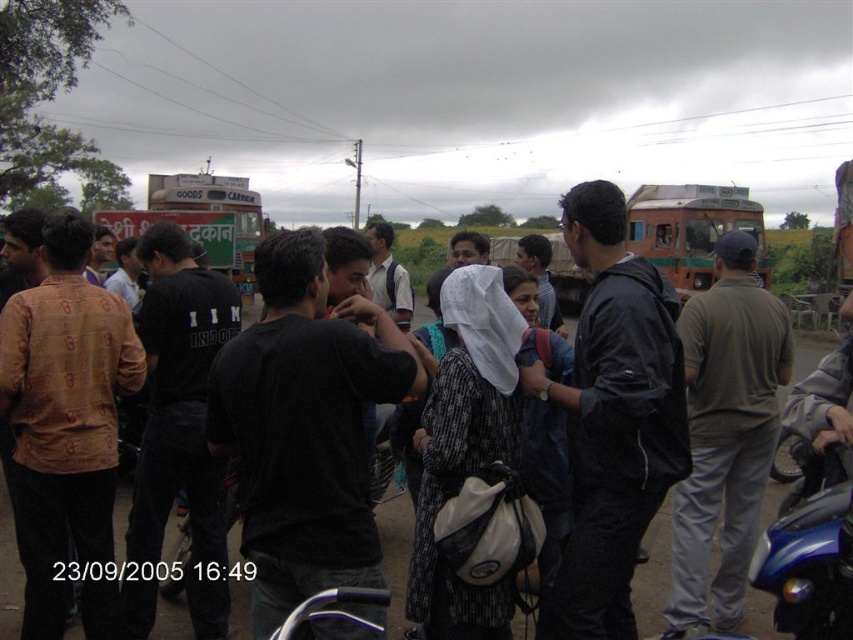
Between light brown cotton shirt at center and green painted goods carrier at upper left, which one has less height?

light brown cotton shirt at center is shorter.

In the scene shown: Between light brown cotton shirt at center and green painted goods carrier at upper left, which one has more height?

green painted goods carrier at upper left is taller.

Is point (730, 429) positioned after point (199, 243)?

That is False.

Find the location of `light brown cotton shirt at center`. light brown cotton shirt at center is located at coordinates (724, 435).

Who is positioned more to the left, dark blue jacket at center or light brown cotton shirt at center?

From the viewer's perspective, dark blue jacket at center appears more on the left side.

Does point (614, 586) come in front of point (733, 509)?

Yes, it is.

Find the location of a particular element. dark blue jacket at center is located at coordinates (612, 419).

Does green painted bus at center have a larger size compared to green painted goods carrier at upper left?

Actually, green painted bus at center might be smaller than green painted goods carrier at upper left.

Is point (694, 228) closer to camera compared to point (252, 259)?

Yes, it is in front of point (252, 259).

Locate an element on the screen. The image size is (853, 640). green painted bus at center is located at coordinates (691, 228).